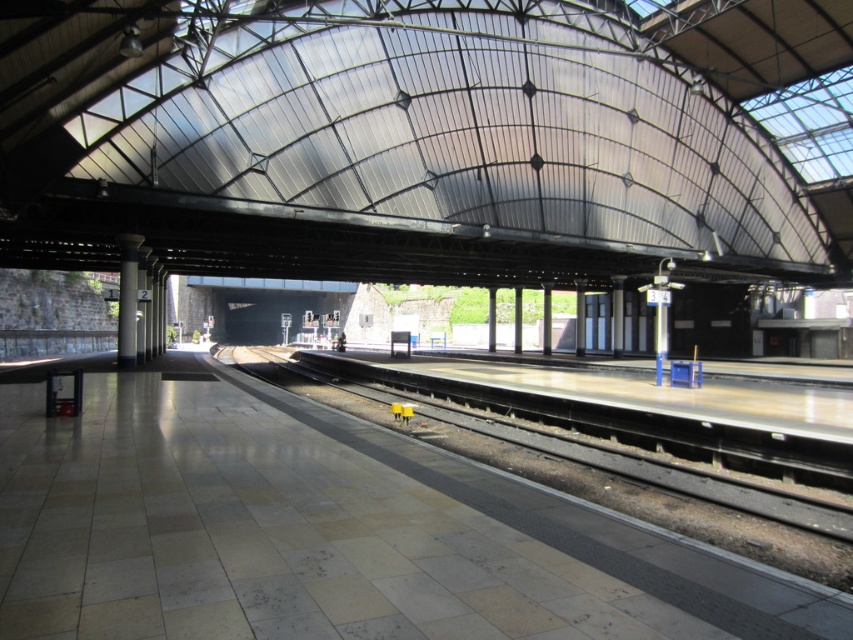
Question: Can you confirm if smooth concrete platform at center is smaller than smooth concrete pillar at center?

Choices:
 (A) yes
 (B) no

Answer: (B)

Question: Is smooth concrete platform at center further to the viewer compared to smooth concrete pillar at center?

Choices:
 (A) yes
 (B) no

Answer: (B)

Question: Which point appears farthest from the camera in this image?

Choices:
 (A) (309, 429)
 (B) (125, 362)

Answer: (B)

Question: Among these points, which one is farthest from the camera?

Choices:
 (A) (117, 333)
 (B) (764, 600)

Answer: (A)

Question: Can you confirm if smooth concrete platform at center is wider than smooth concrete pillar at center?

Choices:
 (A) yes
 (B) no

Answer: (A)

Question: Which point is closer to the camera taking this photo?

Choices:
 (A) (483, 609)
 (B) (129, 243)

Answer: (A)